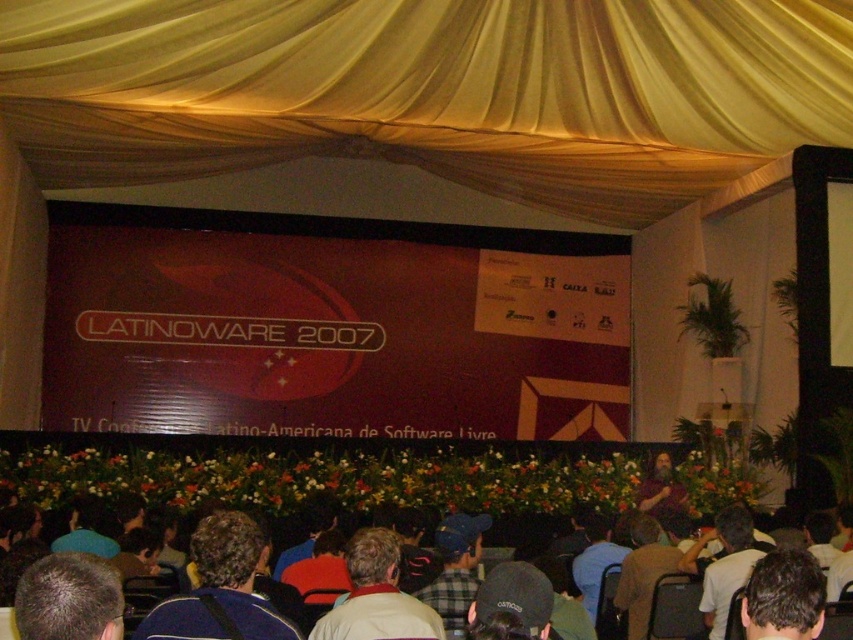
You are standing at the entrance of the conference hall and notice a golden yellow fabric draping the stage area. There is a point marked at coordinates [431,90]. Based on the scene description, can you identify what this point corresponds to?

The point at coordinates [431,90] corresponds to the yellow fabric curtain at upper center as described in the scene.

You are an event organizer setting up for the conference. You need to hang a decorative banner that must be placed exactly at the center of the stage. The banner is 1 meter wide. The yellow fabric curtain at upper center is currently positioned at coordinates point 0.142, 0.506. Can you confirm if the curtain is at the center of the stage to place the banner there?

The yellow fabric curtain at upper center is located at point (x=431, y=90). Since the banner needs to be placed exactly at the center of the stage, you should verify the curtain position against the stage center coordinates to ensure alignment before placing the banner there.

You are an event organizer standing in the middle of the room. You need to decide which object is taller between the yellow fabric curtain at upper center and the light brown fabric jacket at lower center. Based on the scene, can you determine which one is taller?

The yellow fabric curtain at upper center is not as tall as the light brown fabric jacket at lower center, so the light brown fabric jacket at lower center is taller.